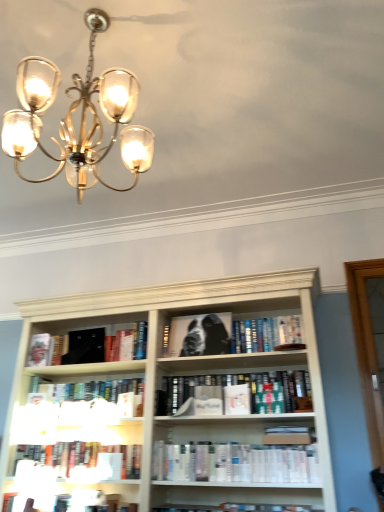
You are a GUI agent. You are given a task and a screenshot of the screen. Output one action in this format:
    pyautogui.click(x=<x>, y=<y>)
    Task: Click on the white matte paperback book at center, the 2th paperback book in the front-to-back sequence
    This screenshot has height=512, width=384.
    Given the screenshot: What is the action you would take?
    pyautogui.click(x=208, y=400)

Identify the location of hardcover book at center, positioned as the 1th paperback book in right-to-left order. (237, 399).

Measure the distance between black matte book at left, placed as the 7th book when sorted from bottom to top, and camera.

black matte book at left, placed as the 7th book when sorted from bottom to top, and camera are 2.59 meters apart from each other.

The width and height of the screenshot is (384, 512). Find the location of `hardcover book at lower center, which ranks as the eighth book in top-to-bottom order`. hardcover book at lower center, which ranks as the eighth book in top-to-bottom order is located at coordinates (65, 499).

Between black matte book at upper left, the second paperback book from the left, and white matte book at lower center, the 2th book in the bottom-to-top sequence, which one appears on the right side from the viewer's perspective?

white matte book at lower center, the 2th book in the bottom-to-top sequence.

Identify the location of the 6th book below the black matte book at upper left, the second paperback book from the left (from the image's perspective). This screenshot has height=512, width=384. (239, 508).

From a real-world perspective, who is located higher, black matte book at upper left, marked as the 3th paperback book in a front-to-back arrangement, or white matte book at lower center, the 7th book positioned from the top?

black matte book at upper left, marked as the 3th paperback book in a front-to-back arrangement.

Considering the sizes of objects black matte book at upper left, the 2th paperback book viewed from the back, and white matte book at lower center, the 7th book positioned from the top, in the image provided, who is thinner, black matte book at upper left, the 2th paperback book viewed from the back, or white matte book at lower center, the 7th book positioned from the top,?

black matte book at upper left, the 2th paperback book viewed from the back.

Is white matte paperback book at center, the 2th paperback book in the front-to-back sequence, bigger than black matte book at left, the second book positioned from the top?

Actually, white matte paperback book at center, the 2th paperback book in the front-to-back sequence, might be smaller than black matte book at left, the second book positioned from the top.

Is white matte paperback book at center, placed as the 3th paperback book when sorted from left to right, inside or outside of black matte book at left, the second book positioned from the top?

white matte paperback book at center, placed as the 3th paperback book when sorted from left to right, exists outside the volume of black matte book at left, the second book positioned from the top.

How different are the orientations of white matte paperback book at center, placed as the 3th paperback book when sorted from left to right, and black matte book at left, placed as the 7th book when sorted from bottom to top, in degrees?

The angle between the facing direction of white matte paperback book at center, placed as the 3th paperback book when sorted from left to right, and the facing direction of black matte book at left, placed as the 7th book when sorted from bottom to top, is 3.44 degrees.

Is white matte paperback book at center, placed as the 3th paperback book when sorted from left to right, turned away from black matte book at left, the second book positioned from the top?

No, white matte paperback book at center, placed as the 3th paperback book when sorted from left to right, is not facing the opposite direction of black matte book at left, the second book positioned from the top.

From a real-world perspective, is white paperbacks at center, the 4th book in the bottom-to-top sequence, on white matte book at center, placed as the 4th book when sorted from top to bottom?

No, from a real-world perspective, white paperbacks at center, the 4th book in the bottom-to-top sequence, is not above white matte book at center, placed as the 4th book when sorted from top to bottom.

How much distance is there between white paperbacks at center, the fifth book in the top-to-bottom sequence, and white matte book at center, which is the fifth book in bottom-to-top order?

A distance of 25.05 inches exists between white paperbacks at center, the fifth book in the top-to-bottom sequence, and white matte book at center, which is the fifth book in bottom-to-top order.

Which object is positioned more to the left, white paperbacks at center, the fifth book in the top-to-bottom sequence, or white matte book at center, placed as the 4th book when sorted from top to bottom?

white matte book at center, placed as the 4th book when sorted from top to bottom.

Is the depth of white paperbacks at center, the 4th book in the bottom-to-top sequence, greater than that of white matte book at center, placed as the 4th book when sorted from top to bottom?

That is False.

Can you confirm if white matte paperback book at center, acting as the 3th paperback book starting from the back, is smaller than hardcover book at center, positioned as the 3th book in top-to-bottom order?

Yes.

In the scene shown: From a real-world perspective, between white matte paperback book at center, acting as the 3th paperback book starting from the back, and hardcover book at center, the sixth book in the bottom-to-top sequence, who is vertically lower?

white matte paperback book at center, acting as the 3th paperback book starting from the back, is physically lower.

The width and height of the screenshot is (384, 512). Identify the location of the 2nd book in front of the white matte paperback book at center, placed as the 3th paperback book when sorted from left to right. (239, 384).

Which of these two, white matte paperback book at center, the 2th paperback book in the front-to-back sequence, or hardcover book at center, the sixth book in the bottom-to-top sequence, is wider?

hardcover book at center, the sixth book in the bottom-to-top sequence, is wider.

In the scene shown: From a real-world perspective, is white matte book at center, placed as the 4th book when sorted from top to bottom, physically above black matte book at left, the second book positioned from the top?

No, from a real-world perspective, white matte book at center, placed as the 4th book when sorted from top to bottom, is not over black matte book at left, the second book positioned from the top

Which is less distant, (97, 396) or (105, 350)?

Point (97, 396)

From the image's perspective, relative to black matte book at left, placed as the 7th book when sorted from bottom to top, is white matte book at center, which is the fifth book in bottom-to-top order, above or below?

Based on their image positions, white matte book at center, which is the fifth book in bottom-to-top order, is located beneath black matte book at left, placed as the 7th book when sorted from bottom to top.

You are a GUI agent. You are given a task and a screenshot of the screen. Output one action in this format:
    pyautogui.click(x=<x>, y=<y>)
    Task: Click on the book that is the 1st one when counting forward from the black matte book at left, the second book positioned from the top
    The width and height of the screenshot is (384, 512).
    Given the screenshot: What is the action you would take?
    pyautogui.click(x=93, y=395)

From a real-world perspective, starting from the hardcover book at center, positioned as the 3th book in top-to-bottom order, which paperback book is the 2nd one below it? Please provide its 2D coordinates.

[(237, 399)]

Which of these two, hardcover book at center, positioned as the 1th paperback book in right-to-left order, or hardcover book at center, the sixth book in the bottom-to-top sequence, stands shorter?

Standing shorter between the two is hardcover book at center, positioned as the 1th paperback book in right-to-left order.

Looking at the image, does hardcover book at center, which is counted as the 4th paperback book, starting from the left, seem bigger or smaller compared to hardcover book at center, the sixth book in the bottom-to-top sequence?

In the image, hardcover book at center, which is counted as the 4th paperback book, starting from the left, appears to be smaller than hardcover book at center, the sixth book in the bottom-to-top sequence.

Considering the positions of objects hardcover book at center, which is the 1th paperback book from front to back, and hardcover book at center, positioned as the 3th book in top-to-bottom order, in the image provided, who is more to the left, hardcover book at center, which is the 1th paperback book from front to back, or hardcover book at center, positioned as the 3th book in top-to-bottom order,?

hardcover book at center, positioned as the 3th book in top-to-bottom order, is more to the left.

From the picture: Which object is wider, hardcover book at left, arranged as the 4th paperback book when viewed from the front, or matte gold chandelier at upper left?

matte gold chandelier at upper left is wider.

Can you confirm if hardcover book at left, arranged as the 4th paperback book when viewed from the front, is positioned to the right of matte gold chandelier at upper left?

In fact, hardcover book at left, arranged as the 4th paperback book when viewed from the front, is to the left of matte gold chandelier at upper left.

Identify the location of lamp that is on the right side of hardcover book at left, the 1th paperback book from the left. This screenshot has width=384, height=512. (80, 118).

Starting from the black matte book at upper left, the second paperback book from the left, which book is the 5th one to the right? Please provide its 2D coordinates.

[(239, 508)]

Where is `the 2nd paperback book in front of the black matte book at left, placed as the 7th book when sorted from bottom to top`? Image resolution: width=384 pixels, height=512 pixels. the 2nd paperback book in front of the black matte book at left, placed as the 7th book when sorted from bottom to top is located at coordinates (208, 400).

Considering their positions, is black matte book at left, placed as the 7th book when sorted from bottom to top, positioned further to white matte book at lower center, the 7th book positioned from the top, than hardcover book at center, positioned as the 1th paperback book in right-to-left order?

Based on the image, black matte book at left, placed as the 7th book when sorted from bottom to top, appears to be further to white matte book at lower center, the 7th book positioned from the top.

Estimate the real-world distances between objects in this image. Which object is further from hardcover book at center, which ranks as the fourth paperback book in back-to-front order, black glossy book at center or black matte book at left, the second book positioned from the top?

Among the two, black matte book at left, the second book positioned from the top, is located further to hardcover book at center, which ranks as the fourth paperback book in back-to-front order.

When comparing their distances from matte gold chandelier at upper left, does hardcover book at center, the sixth book in the bottom-to-top sequence, or black matte book at center, which is the first book from top to bottom, seem closer?

The object closer to matte gold chandelier at upper left is black matte book at center, which is the first book from top to bottom.

Which object lies nearer to the anchor point hardcover book at left, the 1th paperback book from the left, black matte book at left, the second book positioned from the top, or hardcover book at center, which ranks as the fourth paperback book in back-to-front order?

black matte book at left, the second book positioned from the top.

When comparing their distances from hardcover books at lower center, the third book in the bottom-to-top sequence, does hardcover book at center, which ranks as the fourth paperback book in back-to-front order, or hardcover book at left, the 1th paperback book from the left, seem closer?

Based on the image, hardcover book at left, the 1th paperback book from the left, appears to be nearer to hardcover books at lower center, the third book in the bottom-to-top sequence.

When comparing their distances from matte gold chandelier at upper left, does hardcover book at center, positioned as the 1th paperback book in right-to-left order, or hardcover book at lower center, placed as the first book when sorted from bottom to top, seem closer?

hardcover book at center, positioned as the 1th paperback book in right-to-left order, is closer to matte gold chandelier at upper left.

From the picture: When comparing their distances from white matte paperback book at center, acting as the second paperback book starting from the right, does matte gold chandelier at upper left or black matte book at center, the 8th book in the bottom-to-top sequence, seem closer?

black matte book at center, the 8th book in the bottom-to-top sequence, lies closer to white matte paperback book at center, acting as the second paperback book starting from the right, than the other object.

When comparing their distances from hardcover book at center, which ranks as the fourth paperback book in back-to-front order, does hardcover book at lower center, which ranks as the eighth book in top-to-bottom order, or black glossy book at center seem further?

hardcover book at lower center, which ranks as the eighth book in top-to-bottom order, is further to hardcover book at center, which ranks as the fourth paperback book in back-to-front order.

Where is `paperback book between black matte book at left, the second book positioned from the top, and hardcover book at center, which ranks as the fourth paperback book in back-to-front order`? The width and height of the screenshot is (384, 512). paperback book between black matte book at left, the second book positioned from the top, and hardcover book at center, which ranks as the fourth paperback book in back-to-front order is located at coordinates [208, 400].

Where is `paperback book between hardcover book at center, positioned as the 1th paperback book in right-to-left order, and white paperbacks at center, the 4th book in the bottom-to-top sequence, from top to bottom`? The height and width of the screenshot is (512, 384). paperback book between hardcover book at center, positioned as the 1th paperback book in right-to-left order, and white paperbacks at center, the 4th book in the bottom-to-top sequence, from top to bottom is located at coordinates point(208,400).

You are a GUI agent. You are given a task and a screenshot of the screen. Output one action in this format:
    pyautogui.click(x=<x>, y=<y>)
    Task: Click on the paperback book between black matte book at left, placed as the 7th book when sorted from bottom to top, and hardcover book at center, the sixth book in the bottom-to-top sequence, from left to right
    This screenshot has width=384, height=512.
    Given the screenshot: What is the action you would take?
    pyautogui.click(x=208, y=400)

In order to click on dog between black matte book at center, which is the first book from top to bottom, and white matte paperback book at center, placed as the 3th paperback book when sorted from left to right, in the up-down direction in this screenshot , I will do `click(206, 337)`.